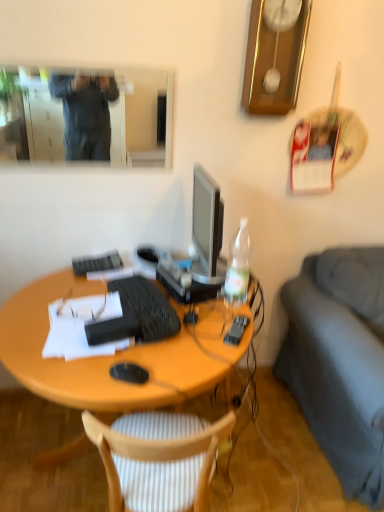
Where is `vacant space in front of matte black glasses at center`? The image size is (384, 512). vacant space in front of matte black glasses at center is located at coordinates (66, 331).